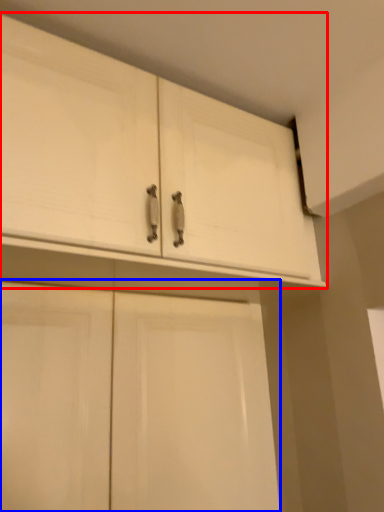
Question: Which of the following is the closest to the observer, cabinetry (highlighted by a red box) or cabinetry (highlighted by a blue box)?

Choices:
 (A) cabinetry
 (B) cabinetry

Answer: (A)